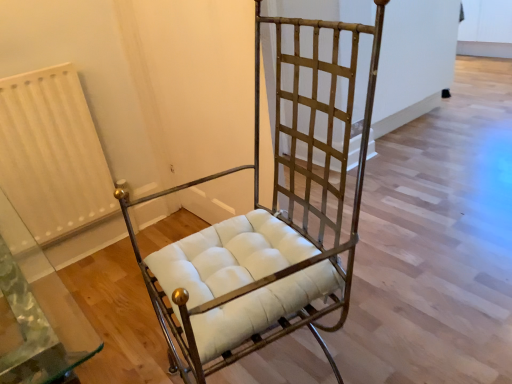
In order to face white textured radiator at left, should I rotate leftwards or rightwards?

Rotate left and turn 26.159 degrees.

Identify the location of white textured radiator at left. pyautogui.click(x=52, y=155).

Describe the element at coordinates (52, 155) in the screenshot. The height and width of the screenshot is (384, 512). I see `white textured radiator at left` at that location.

Describe the element at coordinates (266, 229) in the screenshot. The height and width of the screenshot is (384, 512). I see `gold metal chair at center` at that location.

You are a GUI agent. You are given a task and a screenshot of the screen. Output one action in this format:
    pyautogui.click(x=<x>, y=<y>)
    Task: Click on the gold metal chair at center
    This screenshot has width=512, height=384.
    Given the screenshot: What is the action you would take?
    pyautogui.click(x=266, y=229)

What is the approximate width of gold metal chair at center?

It is 53.66 centimeters.

This screenshot has width=512, height=384. Identify the location of white textured radiator at left. (52, 155).

Can you confirm if white textured radiator at left is positioned to the left of gold metal chair at center?

Indeed, white textured radiator at left is positioned on the left side of gold metal chair at center.

Is the position of white textured radiator at left more distant than that of gold metal chair at center?

Yes, white textured radiator at left is behind gold metal chair at center.

Which is in front, point (96, 174) or point (298, 287)?

The point (298, 287) is more forward.

From the image's perspective, is white textured radiator at left above gold metal chair at center?

Yes, from the image's perspective, white textured radiator at left is above gold metal chair at center.

From a real-world perspective, is white textured radiator at left positioned above or below gold metal chair at center?

In terms of real-world spatial position, white textured radiator at left is below gold metal chair at center.

Looking at their sizes, would you say white textured radiator at left is wider or thinner than gold metal chair at center?

white textured radiator at left is thinner than gold metal chair at center.

Which of these two, white textured radiator at left or gold metal chair at center, stands taller?

Standing taller between the two is gold metal chair at center.

Considering the sizes of white textured radiator at left and gold metal chair at center in the image, is white textured radiator at left bigger or smaller than gold metal chair at center?

In the image, white textured radiator at left appears to be smaller than gold metal chair at center.

Is white textured radiator at left outside of gold metal chair at center?

Yes, white textured radiator at left is outside of gold metal chair at center.

Are white textured radiator at left and gold metal chair at center far apart?

Actually, white textured radiator at left and gold metal chair at center are a little close together.

Is white textured radiator at left facing away from gold metal chair at center?

white textured radiator at left does not have its back to gold metal chair at center.

Measure the distance from white textured radiator at left to gold metal chair at center.

A distance of 32.63 inches exists between white textured radiator at left and gold metal chair at center.

Image resolution: width=512 pixels, height=384 pixels. I want to click on radiator that is under the gold metal chair at center (from a real-world perspective), so click(x=52, y=155).

Is gold metal chair at center to the left or to the right of white textured radiator at left in the image?

gold metal chair at center is to the right of white textured radiator at left.

Which object is closer to the camera taking this photo, gold metal chair at center or white textured radiator at left?

Positioned in front is gold metal chair at center.

Which point is more forward, [261,255] or [80,97]?

Positioned in front is point [261,255].

From the image's perspective, which is below, gold metal chair at center or white textured radiator at left?

gold metal chair at center.

From a real-world perspective, who is located higher, gold metal chair at center or white textured radiator at left?

gold metal chair at center, from a real-world perspective.

Which of these two, gold metal chair at center or white textured radiator at left, is thinner?

white textured radiator at left.

Is gold metal chair at center taller than white textured radiator at left?

Yes.

Considering the relative sizes of gold metal chair at center and white textured radiator at left in the image provided, is gold metal chair at center bigger than white textured radiator at left?

Correct, gold metal chair at center is larger in size than white textured radiator at left.

Looking at this image, is white textured radiator at left surrounded by gold metal chair at center?

Definitely not — white textured radiator at left is not inside gold metal chair at center.

Does gold metal chair at center touch white textured radiator at left?

They are not placed beside each other.

Is gold metal chair at center positioned with its back to white textured radiator at left?

Absolutely, gold metal chair at center is directed away from white textured radiator at left.

Can you tell me how much gold metal chair at center and white textured radiator at left differ in facing direction?

gold metal chair at center and white textured radiator at left are facing 12.9 degrees away from each other.

Locate an element on the screen. furniture located above the white textured radiator at left (from a real-world perspective) is located at coordinates (266, 229).

This screenshot has height=384, width=512. Identify the location of furniture on the right of white textured radiator at left. (266, 229).

Find the location of `radiator above the gold metal chair at center (from the image's perspective)`. radiator above the gold metal chair at center (from the image's perspective) is located at coordinates tap(52, 155).